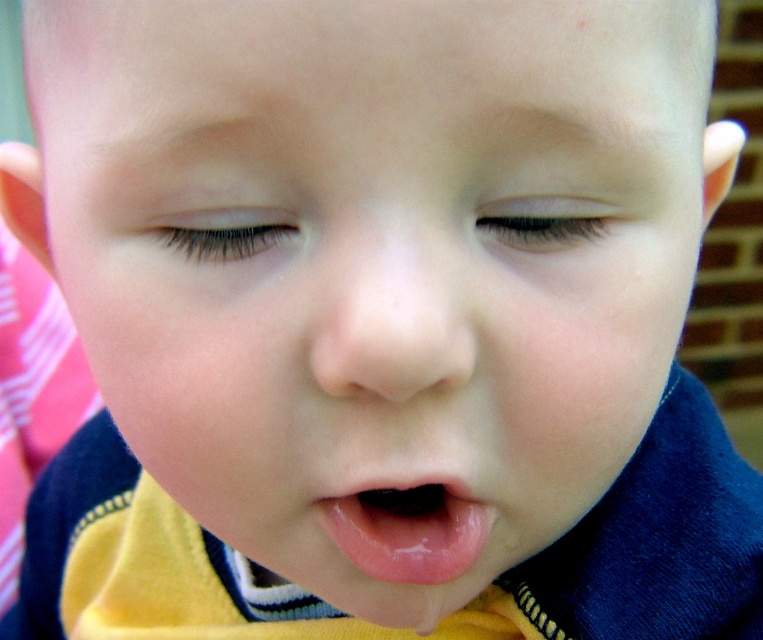
Can you confirm if glossy pink lips at center is positioned above black eyelashes at upper center?

No, glossy pink lips at center is not above black eyelashes at upper center.

Is glossy pink lips at center positioned behind black eyelashes at upper center?

Yes, it is behind black eyelashes at upper center.

Does point (462, 572) come closer to viewer compared to point (266, 248)?

No, (462, 572) is behind (266, 248).

I want to click on glossy pink lips at center, so click(407, 529).

Does smooth flesh-colored nose at center lie behind glossy pink lips at center?

No, it is in front of glossy pink lips at center.

Between point (351, 336) and point (372, 531), which one is positioned behind?

Positioned behind is point (372, 531).

I want to click on smooth flesh-colored nose at center, so click(390, 314).

Is point (596, 209) positioned in front of point (211, 248)?

Yes, point (596, 209) is closer to viewer.

Does smooth skin eye at center appear under black eyelashes at upper center?

Incorrect, smooth skin eye at center is not positioned below black eyelashes at upper center.

Is point (575, 241) behind point (271, 220)?

Yes.

The image size is (763, 640). Identify the location of smooth skin eye at center. (543, 221).